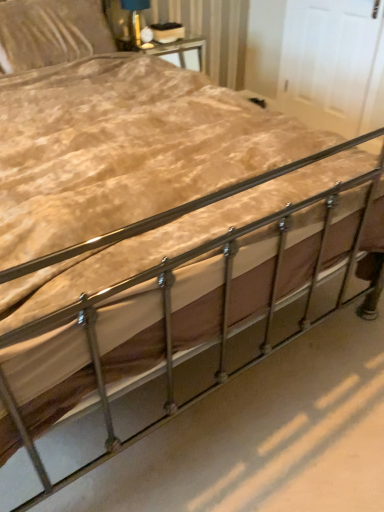
Question: Does matte black lampshade at upper center appear on the left side of velvet beige pillow at upper left?

Choices:
 (A) no
 (B) yes

Answer: (A)

Question: From the image's perspective, is matte black lampshade at upper center located beneath velvet beige pillow at upper left?

Choices:
 (A) no
 (B) yes

Answer: (A)

Question: Can you confirm if matte black lampshade at upper center is smaller than velvet beige pillow at upper left?

Choices:
 (A) yes
 (B) no

Answer: (A)

Question: Is velvet beige pillow at upper left completely or partially inside matte black lampshade at upper center?

Choices:
 (A) yes
 (B) no

Answer: (B)

Question: Does matte black lampshade at upper center have a lesser width compared to velvet beige pillow at upper left?

Choices:
 (A) yes
 (B) no

Answer: (A)

Question: Does matte black lampshade at upper center appear on the right side of velvet beige pillow at upper left?

Choices:
 (A) no
 (B) yes

Answer: (B)

Question: Considering the relative sizes of velvet beige pillow at upper left and matte black lampshade at upper center in the image provided, is velvet beige pillow at upper left thinner than matte black lampshade at upper center?

Choices:
 (A) no
 (B) yes

Answer: (A)

Question: From a real-world perspective, is velvet beige pillow at upper left on matte black lampshade at upper center?

Choices:
 (A) yes
 (B) no

Answer: (B)

Question: Is velvet beige pillow at upper left positioned beyond the bounds of matte black lampshade at upper center?

Choices:
 (A) no
 (B) yes

Answer: (B)

Question: From a real-world perspective, is velvet beige pillow at upper left under matte black lampshade at upper center?

Choices:
 (A) no
 (B) yes

Answer: (B)

Question: Are velvet beige pillow at upper left and matte black lampshade at upper center located far from each other?

Choices:
 (A) no
 (B) yes

Answer: (A)

Question: Does velvet beige pillow at upper left have a lesser height compared to matte black lampshade at upper center?

Choices:
 (A) yes
 (B) no

Answer: (B)

Question: Considering the positions of matte black lampshade at upper center and velvet beige pillow at upper left in the image, is matte black lampshade at upper center bigger or smaller than velvet beige pillow at upper left?

Choices:
 (A) big
 (B) small

Answer: (B)